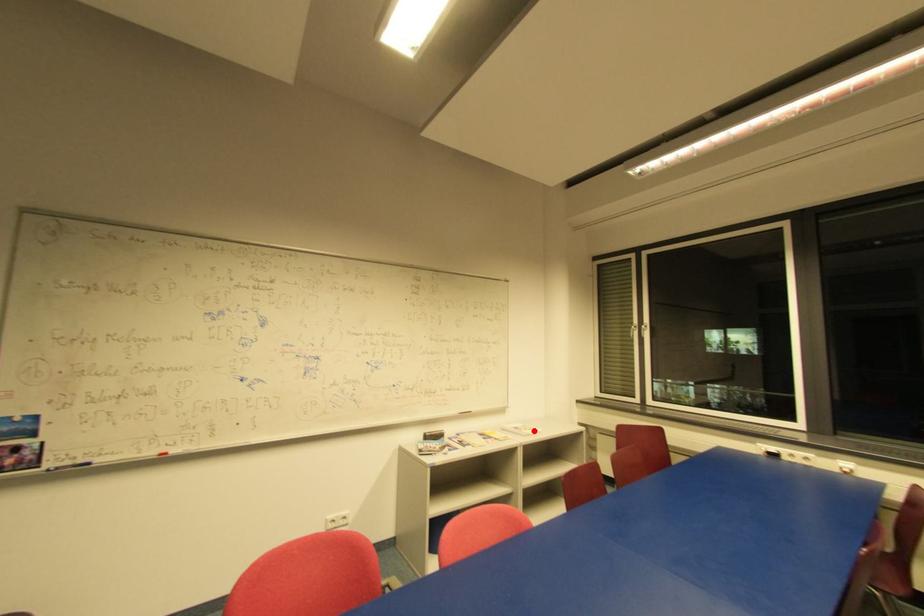
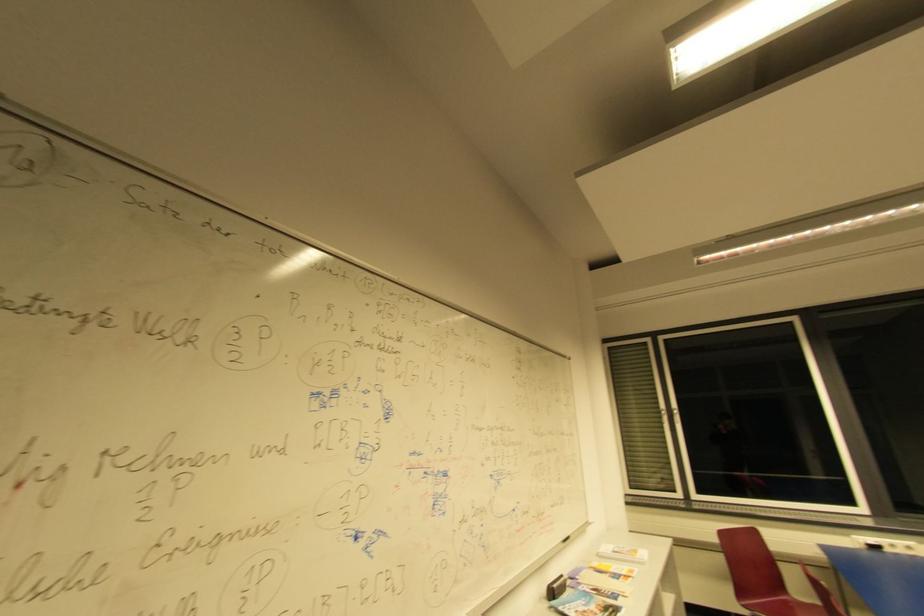
Question: A red point is marked in image1. In image2, is the corresponding 3D point closer to the camera or farther? Reply with the corresponding letter.

Choices:
 (A) The corresponding 3D point is closer.
 (B) The corresponding 3D point is farther.

Answer: (A)